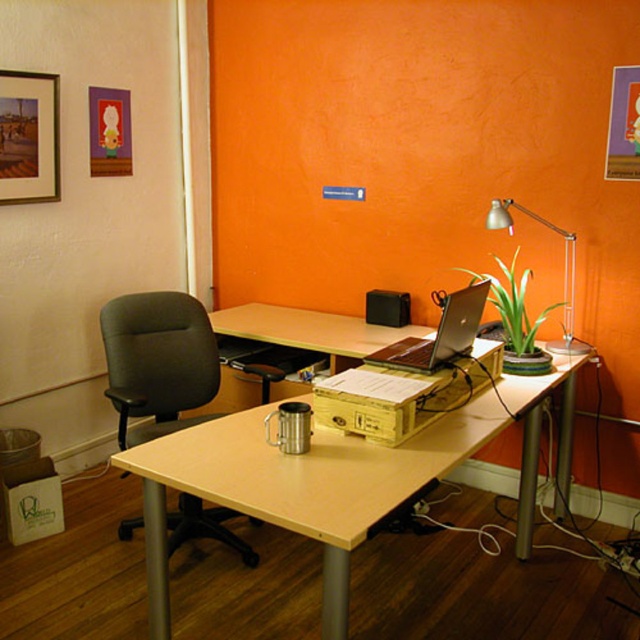
Question: Among these points, which one is farthest from the camera?

Choices:
 (A) (634, 170)
 (B) (13, 109)

Answer: (B)

Question: In this image, where is wooden framed picture at upper left located relative to matte black laptop at center?

Choices:
 (A) below
 (B) above

Answer: (B)

Question: Does light wood/wooden desk at center appear on the left side of metallic silver desk lamp at upper right?

Choices:
 (A) yes
 (B) no

Answer: (A)

Question: Considering the relative positions of light wood/wooden desk at center and matte orange picture frame at upper right in the image provided, where is light wood/wooden desk at center located with respect to matte orange picture frame at upper right?

Choices:
 (A) above
 (B) below

Answer: (B)

Question: Based on their relative distances, which object is nearer to the light wood/wooden desk at center?

Choices:
 (A) metallic silver desk lamp at upper right
 (B) black leather swivel chair at left

Answer: (A)

Question: Which point is farther to the camera?

Choices:
 (A) (616, 122)
 (B) (573, 244)

Answer: (B)